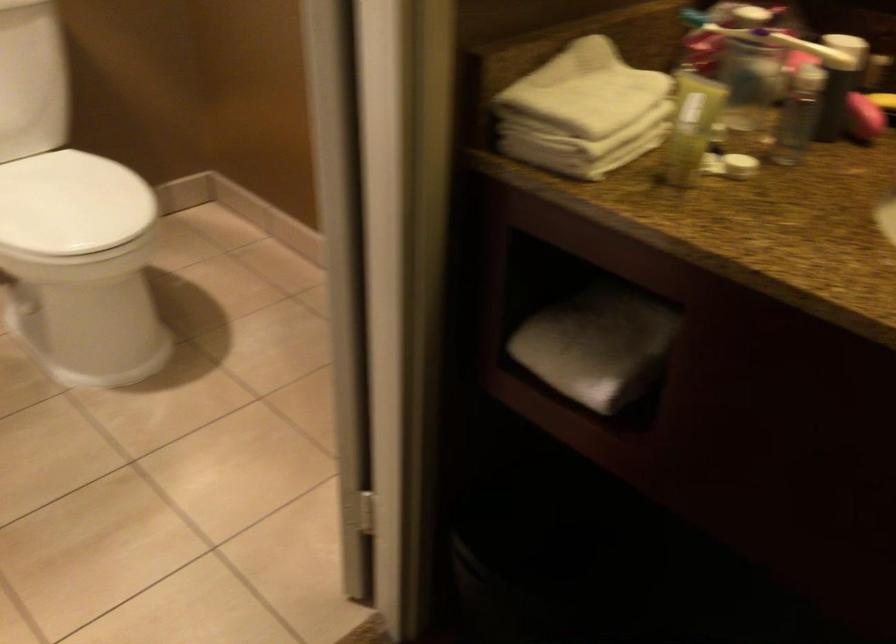
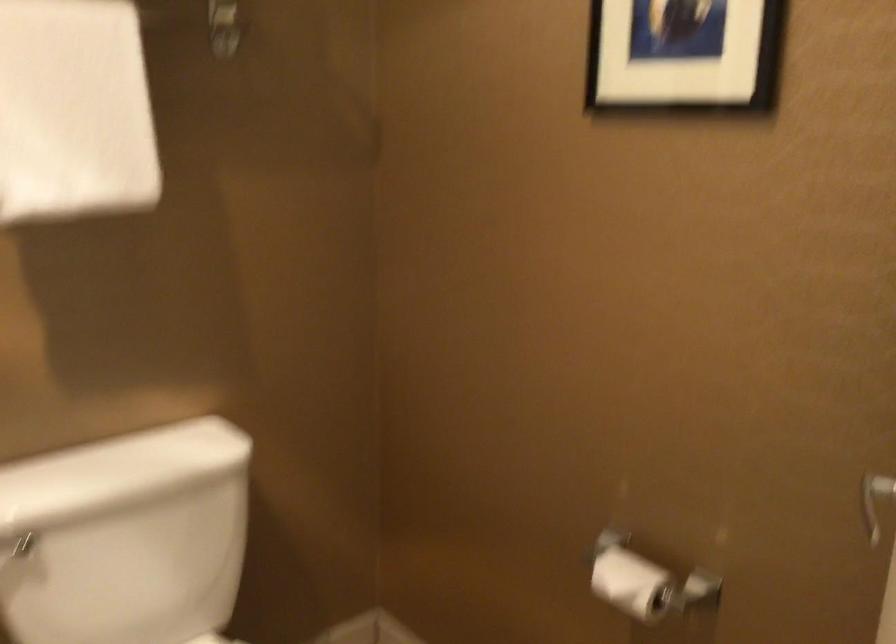
Question: How did the camera likely rotate?

Choices:
 (A) Left
 (B) Right
 (C) Up
 (D) Down

Answer: (C)